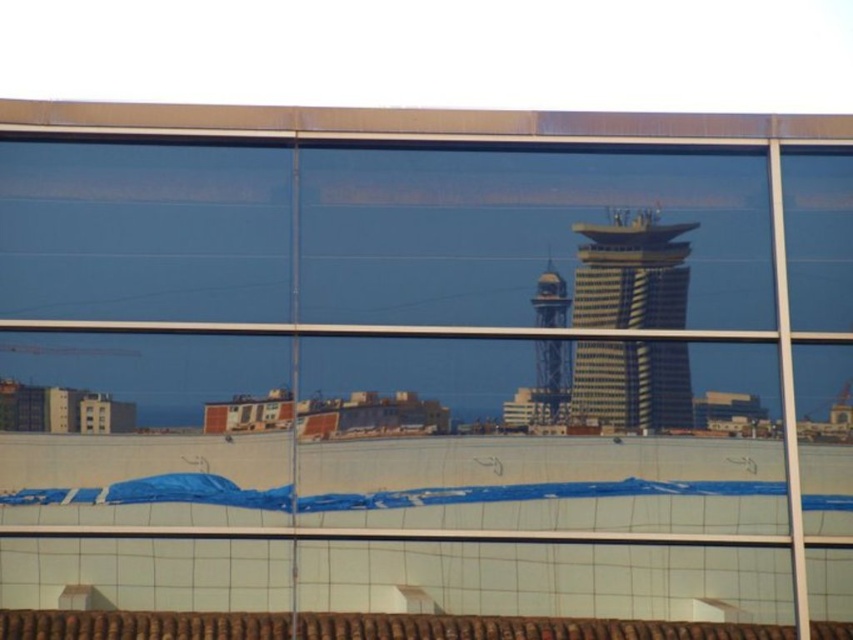
You are standing in front of a building with a reflective glass facade. You see two towers reflected in the glass, the smooth glass tower at center and the shiny glass tower at center. Which tower appears closer to you in the reflection?

The smooth glass tower at center appears closer to you in the reflection because it is positioned closer to the viewer than the shiny glass tower at center.